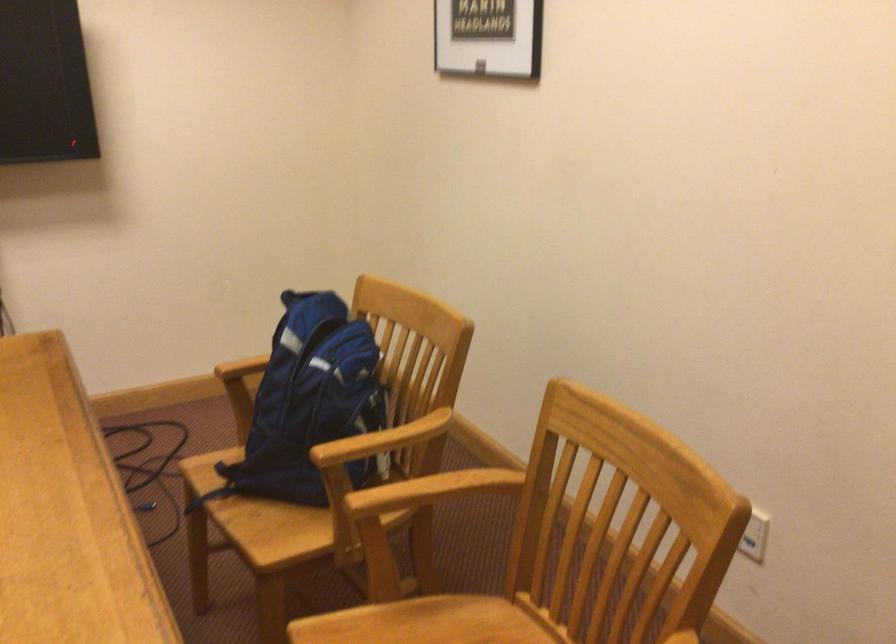
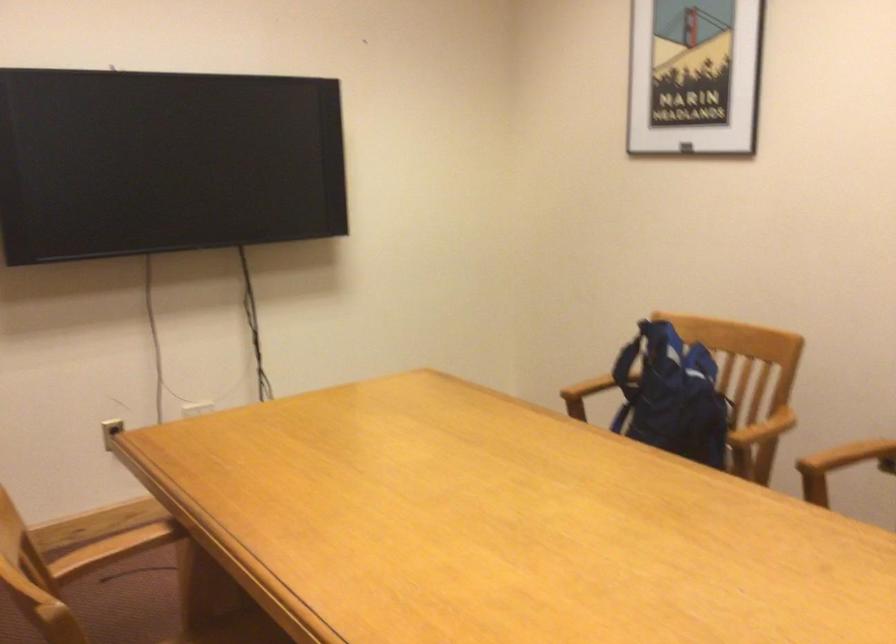
In the second image, find the point that corresponds to (307,389) in the first image.

(672, 395)